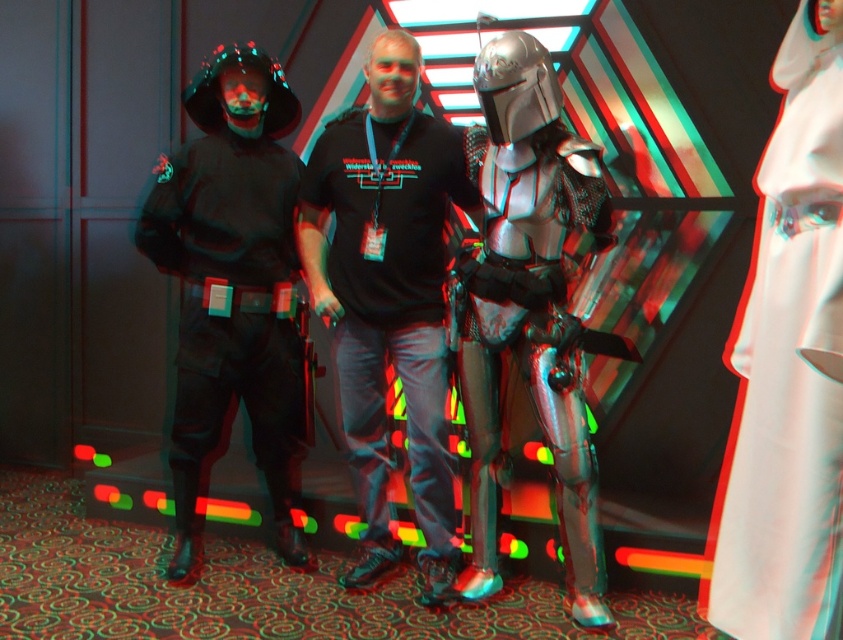
Question: Does black matte t-shirt at center appear under shiny silver armor at center?

Choices:
 (A) no
 (B) yes

Answer: (A)

Question: Which object appears farthest from the camera in this image?

Choices:
 (A) shiny silver armor at center
 (B) black matte costume at left

Answer: (B)

Question: Which point appears farthest from the camera in this image?

Choices:
 (A) (433, 268)
 (B) (242, 138)

Answer: (B)

Question: Is black matte costume at left positioned at the back of shiny silver armor at center?

Choices:
 (A) yes
 (B) no

Answer: (A)

Question: Which object appears farthest from the camera in this image?

Choices:
 (A) white satin dress at center
 (B) black matte costume at left

Answer: (B)

Question: Is the position of white satin dress at center more distant than that of shiny silver armor at center?

Choices:
 (A) yes
 (B) no

Answer: (B)